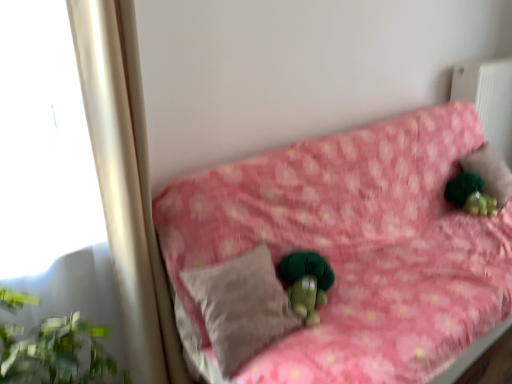
Question: Looking at the image, does green fuzzy figurine at upper right seem bigger or smaller compared to beige soft pillow at center, acting as the second pillow starting from the back?

Choices:
 (A) small
 (B) big

Answer: (A)

Question: Is green fuzzy figurine at upper right to the left or to the right of beige soft pillow at center, acting as the 2th pillow starting from the top, in the image?

Choices:
 (A) left
 (B) right

Answer: (B)

Question: Estimate the real-world distances between objects in this image. Which object is farther from the white textured radiator at upper right?

Choices:
 (A) beige soft pillow at center, acting as the 2th pillow starting from the top
 (B) beige fabric pillow at upper right, the second pillow viewed from the left
 (C) pink floral fabric couch at center
 (D) green fuzzy figurine at upper right

Answer: (A)

Question: Based on their relative distances, which object is farther from the white textured radiator at upper right?

Choices:
 (A) green fuzzy figurine at upper right
 (B) beige soft pillow at center, positioned as the 2th pillow in right-to-left order
 (C) beige fabric pillow at upper right, positioned as the first pillow in top-to-bottom order
 (D) pink floral fabric couch at center

Answer: (B)